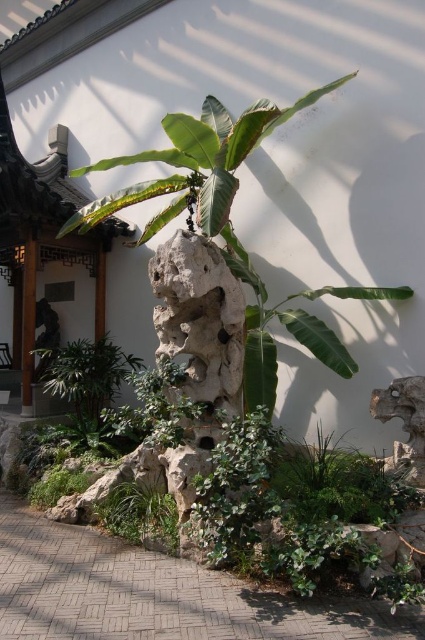
Is point (399, 634) less distant than point (161, 220)?

Yes, it is.

Between point (274, 602) and point (320, 323), which one is positioned behind?

Point (320, 323)

The height and width of the screenshot is (640, 425). What are the coordinates of `paved brick path at lower center` in the screenshot? It's located at (155, 593).

In the scene shown: Is paved brick path at lower center to the left of green leafy plant at lower center from the viewer's perspective?

No, paved brick path at lower center is not to the left of green leafy plant at lower center.

Is paved brick path at lower center further to the viewer compared to green leafy plant at lower center?

No, it is in front of green leafy plant at lower center.

Is point (300, 637) farther from viewer compared to point (135, 512)?

That is False.

Where is `paved brick path at lower center`? paved brick path at lower center is located at coordinates (155, 593).

Can you confirm if green leafy plant at center is wider than green leafy plant at lower center?

Yes.

Does green leafy plant at center appear under green leafy plant at lower center?

No, green leafy plant at center is not below green leafy plant at lower center.

Is point (257, 291) closer to camera compared to point (118, 508)?

No, it is not.

Image resolution: width=425 pixels, height=640 pixels. I want to click on green leafy plant at center, so click(229, 227).